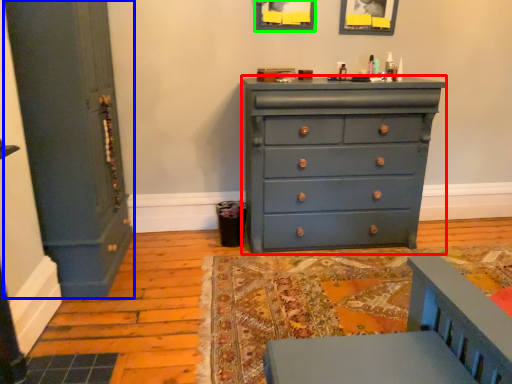
Question: Considering the real-world distances, which object is closest to chest of drawers (highlighted by a red box)? door (highlighted by a blue box) or picture frame (highlighted by a green box).

Choices:
 (A) door
 (B) picture frame

Answer: (B)